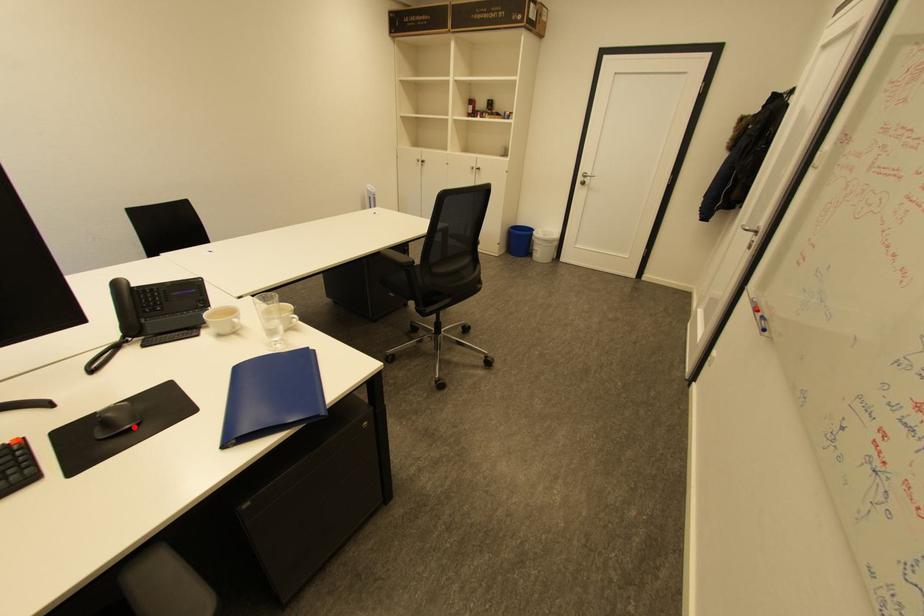
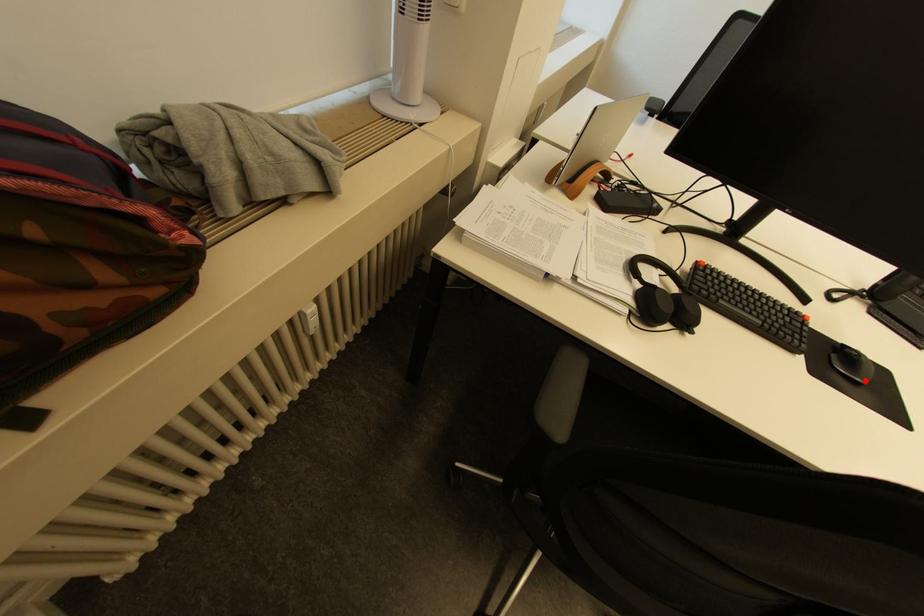
I am providing you with two images of the same scene from different viewpoints. A red point is marked on the first image and another point is marked on the second image. Is the red point in image1 aligned with the point shown in image2?

Yes